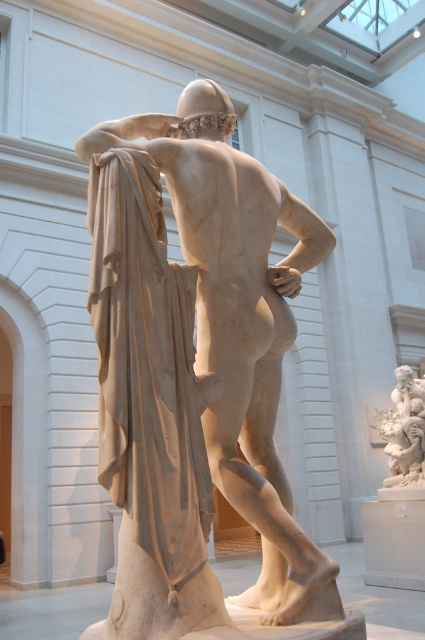
You are an art conservator examining the sculpture. You notice two points on the sculpture marked at coordinates point (249, 316) and point (387, 429). Which point is closer to your viewpoint?

Point (249, 316) is closer to the camera than point (387, 429).

You are a visitor standing in front of the white marble statue at center and the white marble cherub at right. Which object is nearer to you?

The white marble statue at center is closer to the viewer than the white marble cherub at right.